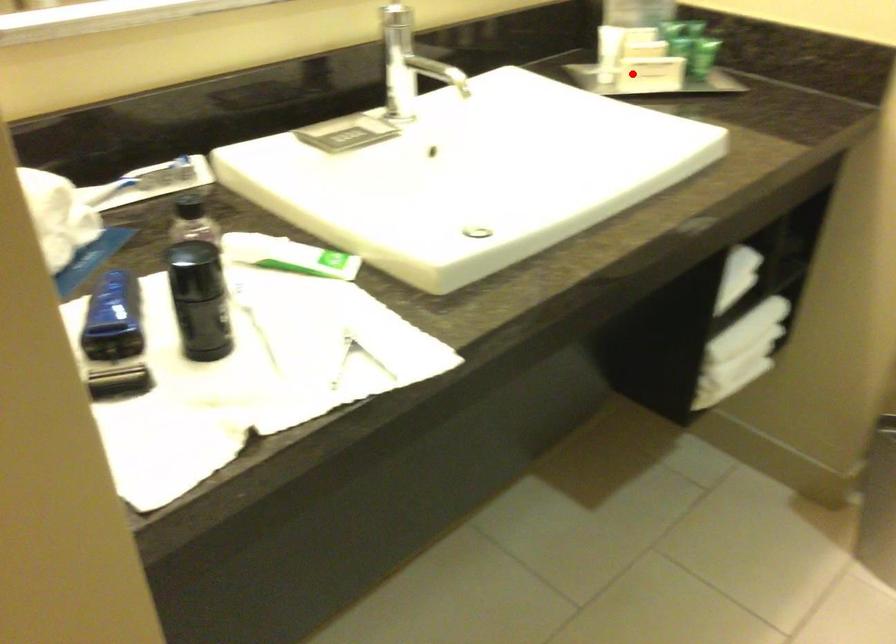
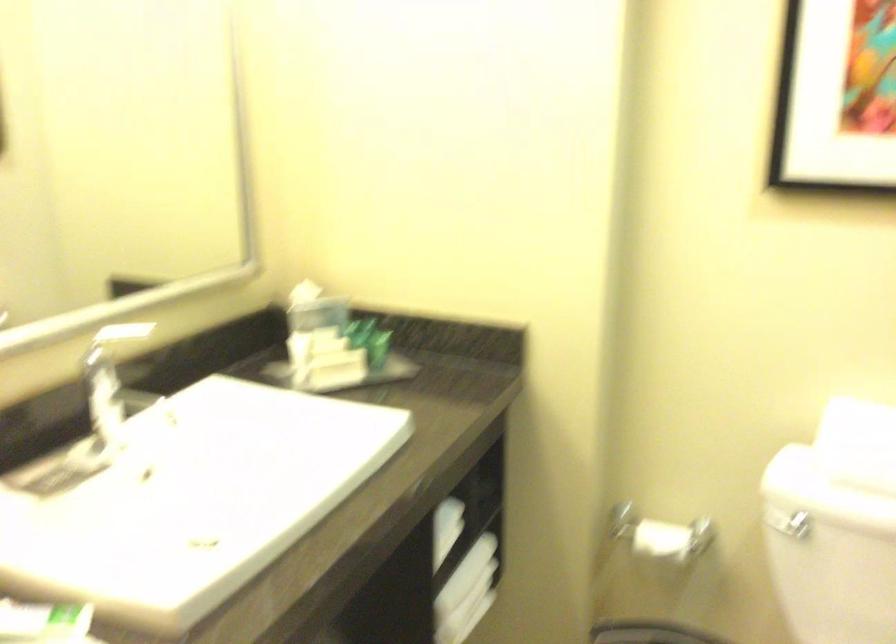
In the second image, find the point that corresponds to the highlighted location in the first image.

(321, 370)